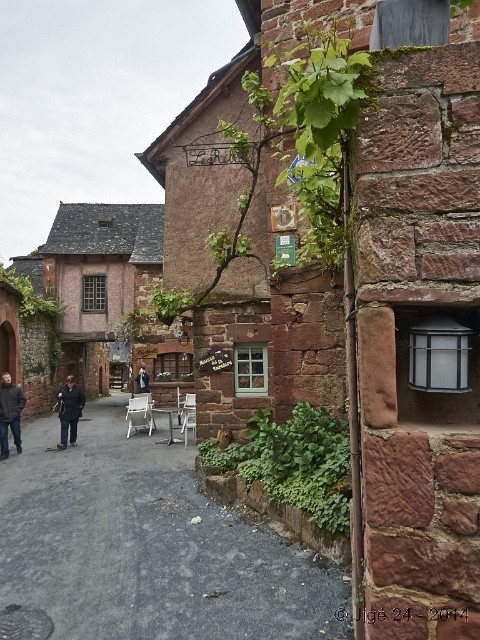
You are standing on the rustic street and see two points marked on the wall. Which point is closer to you, point [60,413] or point [143,378]?

Point [60,413] is in front of point [143,378], so it is closer to you.

You are standing in the rustic street scene and want to know if you can hang a small birdhouse on the smooth stone alley at center without it being blocked by the dark gray fabric jacket at center. Can you do this?

The smooth stone alley at center is taller than the dark gray fabric jacket at center, so yes, you can hang the birdhouse on the smooth stone alley at center without it being blocked by the jacket.

You are standing on the rustic street and see both the dark gray jacket at lower left and the dark gray fabric jacket at center. Which jacket is closer to you?

The dark gray jacket at lower left is closer to you because it is in front of the dark gray fabric jacket at center.